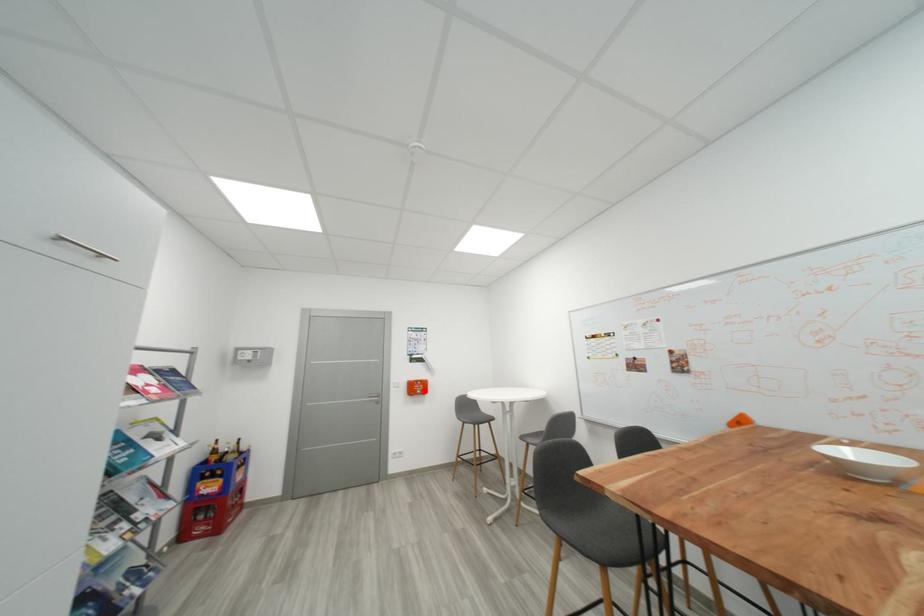
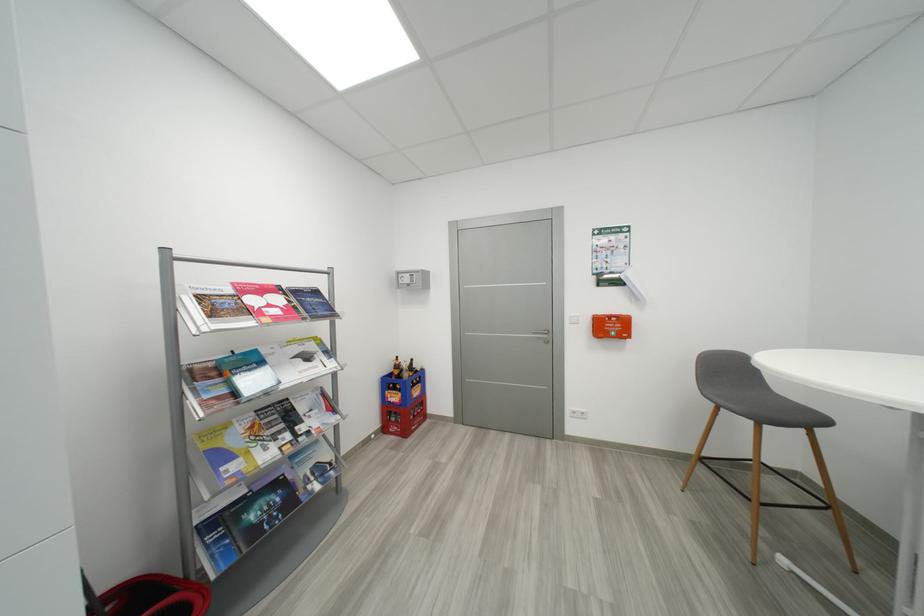
Question: A red point is marked in image1. In image2, is the corresponding 3D point closer to the camera or farther? Reply with the corresponding letter.

Choices:
 (A) The corresponding 3D point is closer.
 (B) The corresponding 3D point is farther.

Answer: (A)